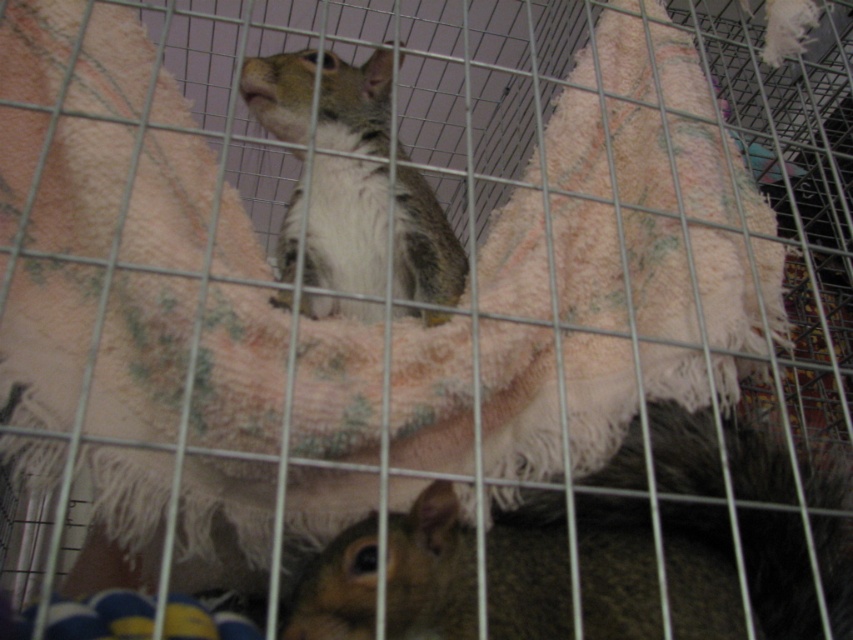
In the scene shown: Which is more to the right, brown furry squirrel at lower center or gray-furred squirrel at center?

brown furry squirrel at lower center is more to the right.

Can you confirm if brown furry squirrel at lower center is smaller than gray-furred squirrel at center?

Correct, brown furry squirrel at lower center occupies less space than gray-furred squirrel at center.

Measure the distance between brown furry squirrel at lower center and camera.

brown furry squirrel at lower center and camera are 23.53 inches apart from each other.

The height and width of the screenshot is (640, 853). I want to click on brown furry squirrel at lower center, so click(431, 570).